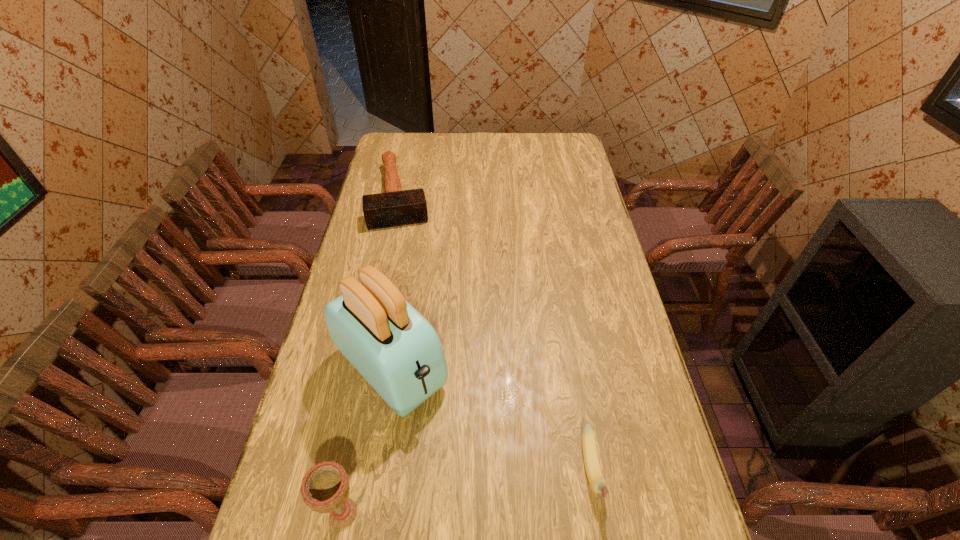
This screenshot has width=960, height=540. I want to click on the closest object to the chalice, so click(x=397, y=351).

Select which object is the second closest to the farthest object. Please provide its 2D coordinates. Your answer should be formatted as a tuple, i.e. [(x, y)], where the tuple contains the x and y coordinates of a point satisfying the conditions above.

[(597, 482)]

Locate an element on the screen. The image size is (960, 540). vacant region that satisfies the following two spatial constraints: 1. on the back side of the toaster; 2. on the right side of the third shortest object is located at coordinates (372, 368).

The image size is (960, 540). Identify the location of free space that satisfies the following two spatial constraints: 1. on the front side of the chalice; 2. on the right side of the farthest object. pos(336,514).

This screenshot has width=960, height=540. I want to click on vacant space that satisfies the following two spatial constraints: 1. on the front side of the tallest object; 2. on the right side of the farthest object, so click(367, 368).

Where is `vacant position in the image that satisfies the following two spatial constraints: 1. on the front side of the farthest object; 2. on the right side of the chalice`? vacant position in the image that satisfies the following two spatial constraints: 1. on the front side of the farthest object; 2. on the right side of the chalice is located at coordinates (336, 514).